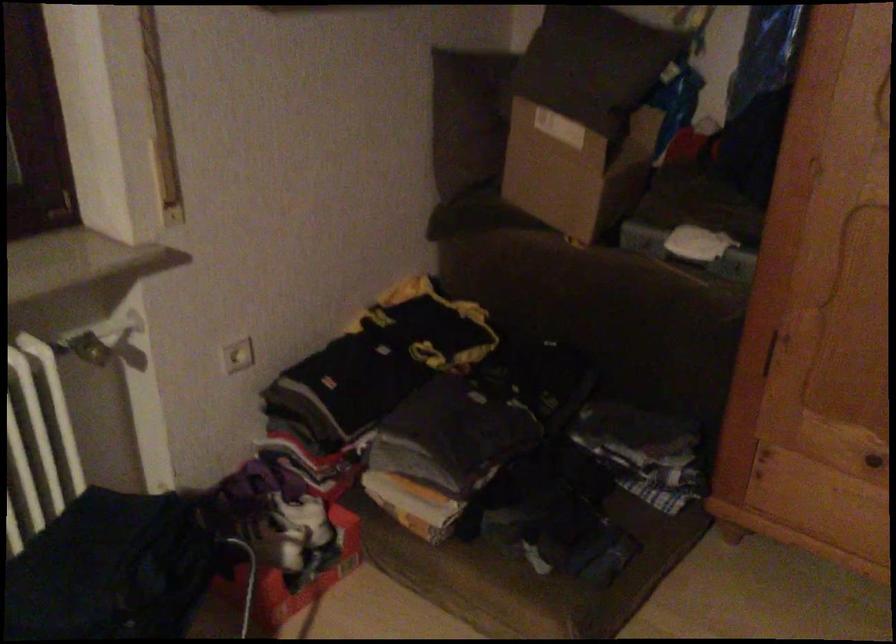
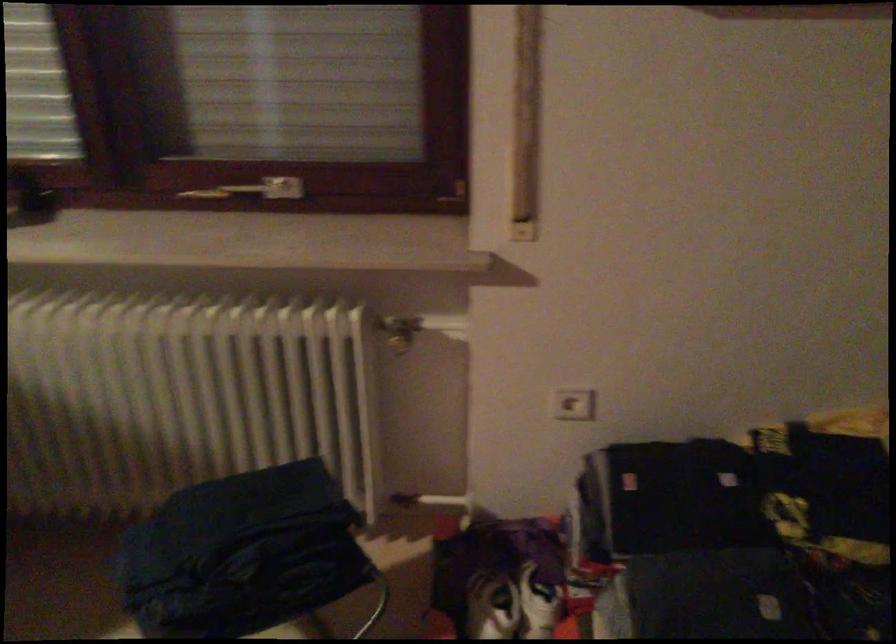
Question: The images are taken continuously from a first-person perspective. In which direction is your viewpoint rotating?

Choices:
 (A) Left
 (B) Right
 (C) Up
 (D) Down

Answer: (A)